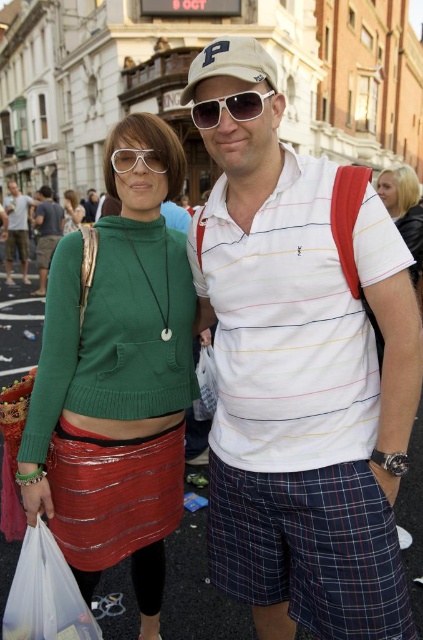
Question: Does shiny red skirt at lower left have a greater width compared to matte black shorts at lower left?

Choices:
 (A) no
 (B) yes

Answer: (A)

Question: Which point is closer to the camera taking this photo?

Choices:
 (A) (49, 209)
 (B) (260, 109)

Answer: (B)

Question: Which point appears closest to the camera in this image?

Choices:
 (A) (142, 161)
 (B) (250, 353)
 (C) (52, 557)

Answer: (C)

Question: Does green knitted sweater at center appear under clear plastic goggles at center?

Choices:
 (A) yes
 (B) no

Answer: (A)

Question: Which point is farther to the camera?

Choices:
 (A) (41, 244)
 (B) (158, 445)
 (C) (35, 202)

Answer: (C)

Question: Can you confirm if blonde hair at upper right is positioned to the left of white plastic sunglasses at center?

Choices:
 (A) yes
 (B) no

Answer: (B)